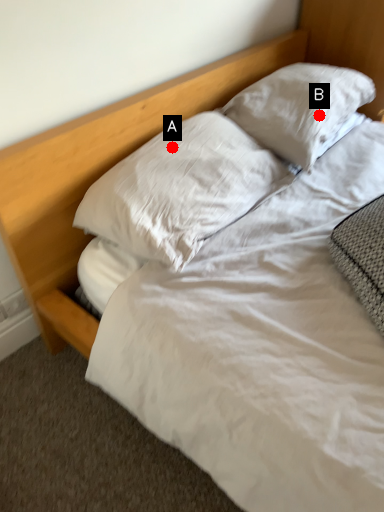
Question: Two points are circled on the image, labeled by A and B beside each circle. Which of the following is the closest to the observer?

Choices:
 (A) A is closer
 (B) B is closer

Answer: (A)